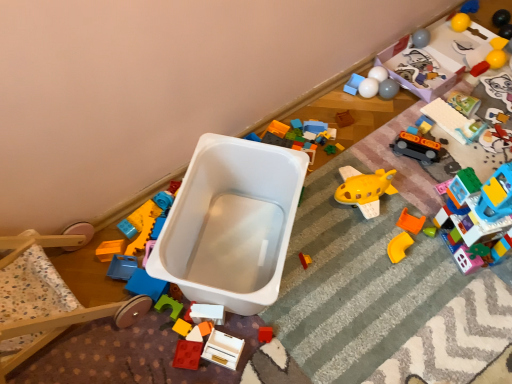
Where is `free space between white plastic toy at center, the 14th toy when ordered from right to left, and orange plastic train at center, the eleventh toy positioned from the left`? The height and width of the screenshot is (384, 512). free space between white plastic toy at center, the 14th toy when ordered from right to left, and orange plastic train at center, the eleventh toy positioned from the left is located at coordinates (330, 221).